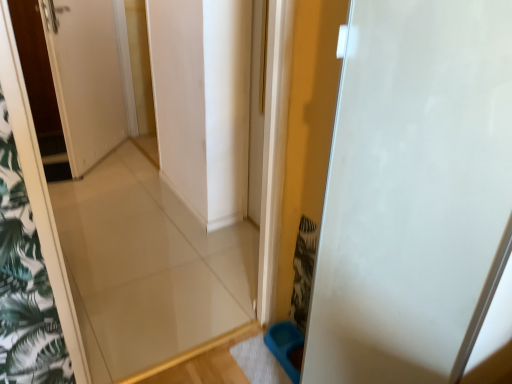
Question: Is the position of white matte door at right, the 2th door in the back-to-front sequence, more distant than that of white glossy door at upper left, positioned as the first door in top-to-bottom order?

Choices:
 (A) yes
 (B) no

Answer: (B)

Question: Considering the relative positions of white matte door at right, the 2th door in the back-to-front sequence, and white glossy door at upper left, positioned as the second door in front-to-back order, in the image provided, is white matte door at right, the 2th door in the back-to-front sequence, to the left of white glossy door at upper left, positioned as the second door in front-to-back order, from the viewer's perspective?

Choices:
 (A) no
 (B) yes

Answer: (A)

Question: Is white matte door at right, which is counted as the second door, starting from the left, outside of white glossy door at upper left, the first door positioned from the back?

Choices:
 (A) yes
 (B) no

Answer: (A)

Question: Can white glossy door at upper left, positioned as the first door in top-to-bottom order, be found inside white matte door at right, which is counted as the second door, starting from the left?

Choices:
 (A) no
 (B) yes

Answer: (A)

Question: Is white matte door at right, the 1th door in the right-to-left sequence, positioned in front of white glossy door at upper left, positioned as the second door in front-to-back order?

Choices:
 (A) no
 (B) yes

Answer: (B)

Question: Is white matte door at right, which is counted as the second door, starting from the left, positioned with its back to white glossy door at upper left, the first door positioned from the back?

Choices:
 (A) no
 (B) yes

Answer: (A)

Question: Considering the relative sizes of white glossy door at upper left, which is counted as the 2th door, starting from the right, and white matte door at right, which ranks as the 1th door in bottom-to-top order, in the image provided, is white glossy door at upper left, which is counted as the 2th door, starting from the right, wider than white matte door at right, which ranks as the 1th door in bottom-to-top order,?

Choices:
 (A) yes
 (B) no

Answer: (B)

Question: Is white glossy door at upper left, which is counted as the 2th door, starting from the right, further to camera compared to white matte door at right, the 2th door in the back-to-front sequence?

Choices:
 (A) no
 (B) yes

Answer: (B)

Question: Can you confirm if white glossy door at upper left, the first door positioned from the back, is positioned to the right of white matte door at right, which ranks as the 1th door in bottom-to-top order?

Choices:
 (A) yes
 (B) no

Answer: (B)

Question: Is white glossy door at upper left, the first door positioned from the back, facing away from white matte door at right, the 1th door in the right-to-left sequence?

Choices:
 (A) no
 (B) yes

Answer: (A)

Question: Is white glossy door at upper left, the first door positioned from the back, positioned in front of white matte door at right, arranged as the 2th door when viewed from the top?

Choices:
 (A) yes
 (B) no

Answer: (B)

Question: Is white glossy door at upper left, acting as the first door starting from the left, bigger than white matte door at right, which is counted as the second door, starting from the left?

Choices:
 (A) yes
 (B) no

Answer: (B)

Question: Relative to white glossy door at upper left, positioned as the first door in top-to-bottom order, is white matte door at right, the 2th door in the back-to-front sequence, in front or behind?

Choices:
 (A) behind
 (B) front

Answer: (B)